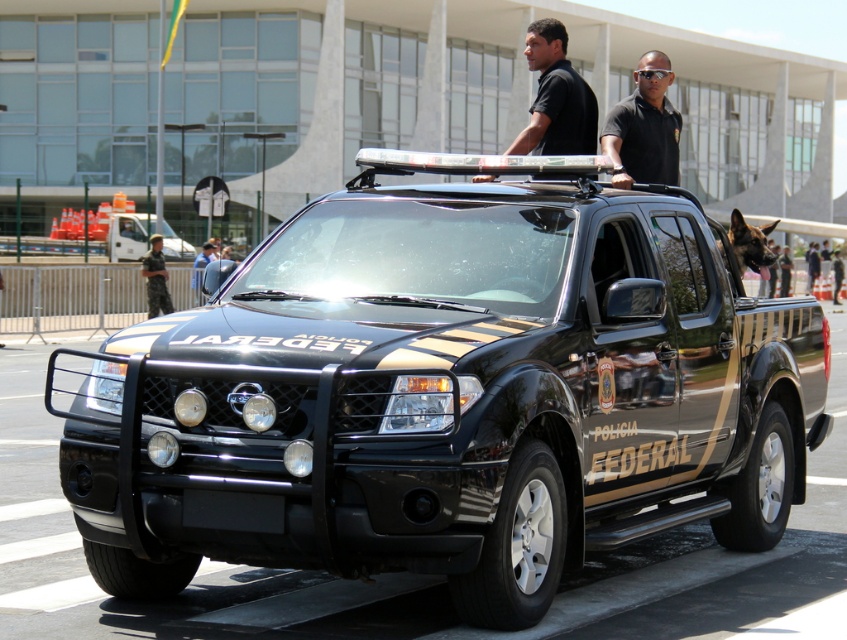
Question: Can you confirm if black matte shirt at upper center is smaller than black uniformed man at center?

Choices:
 (A) no
 (B) yes

Answer: (A)

Question: Which of the following is the closest to the observer?

Choices:
 (A) black smooth shirt at upper center
 (B) black matte shirt at upper center

Answer: (B)

Question: Is blue fabric shirt at upper center below black uniformed man at center?

Choices:
 (A) yes
 (B) no

Answer: (A)

Question: Estimate the real-world distances between objects in this image. Which object is closer to the black matte truck at center?

Choices:
 (A) black smooth shirt at upper center
 (B) black uniformed man at center

Answer: (A)

Question: Does black matte shirt at upper center lie in front of black fur dog at rear right?

Choices:
 (A) yes
 (B) no

Answer: (A)

Question: Which point appears farthest from the camera in this image?

Choices:
 (A) (629, 150)
 (B) (54, 390)
 (C) (817, 273)
 (D) (206, 262)

Answer: (C)